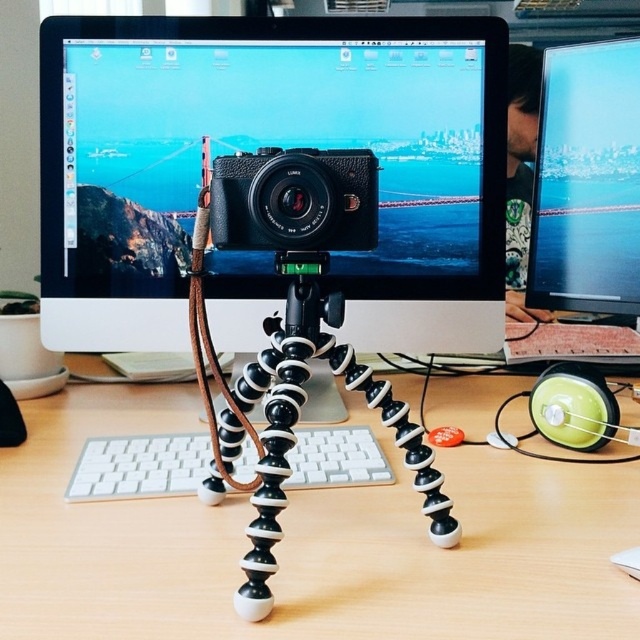
Please describe the position of the wooden at center in terms of coordinates.

The wooden at center is located at coordinates point (x=308, y=541).

You are setting up a video call and need to place your hands on both the white plastic keyboard at center and the white matte mouse at center simultaneously. Can you reach both items comfortably if your arms can extend 16 inches?

The white plastic keyboard at center and the white matte mouse at center are 15.56 inches apart, so yes, you can reach both items comfortably since the distance between them is within your 16 inches arm extension range.